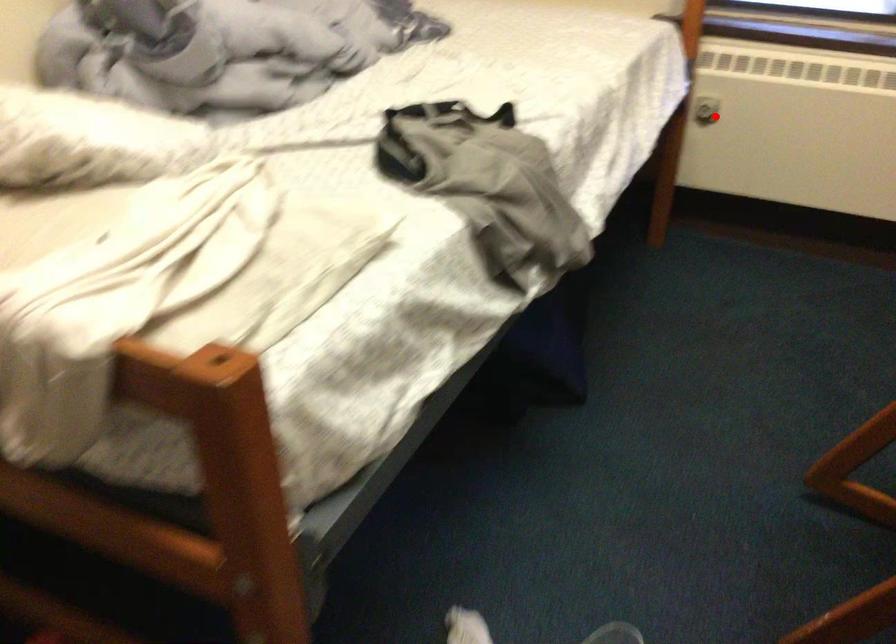
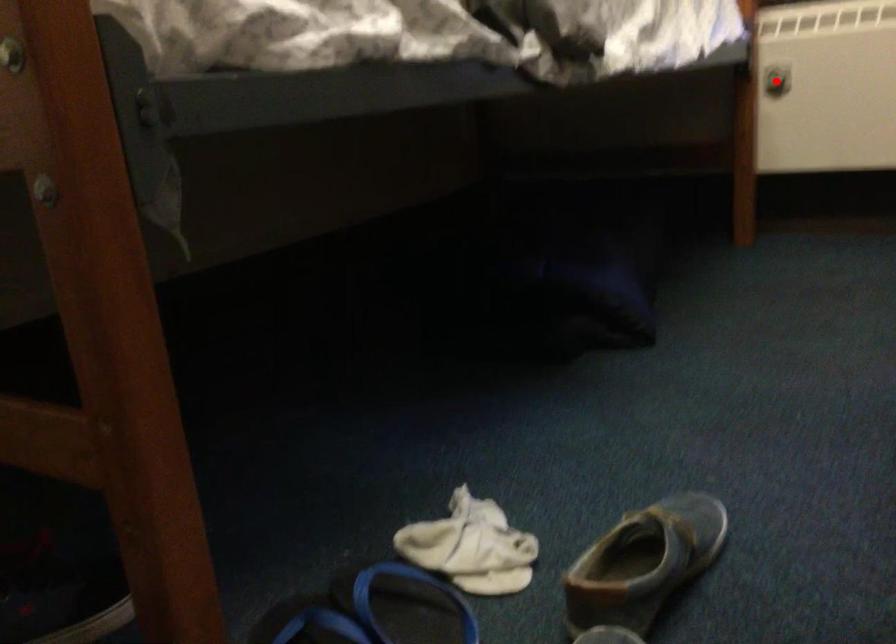
I am providing you with two images of the same scene from different viewpoints. A red point is marked on the first image and another point is marked on the second image. Do the highlighted points in image1 and image2 indicate the same real-world spot?

Yes